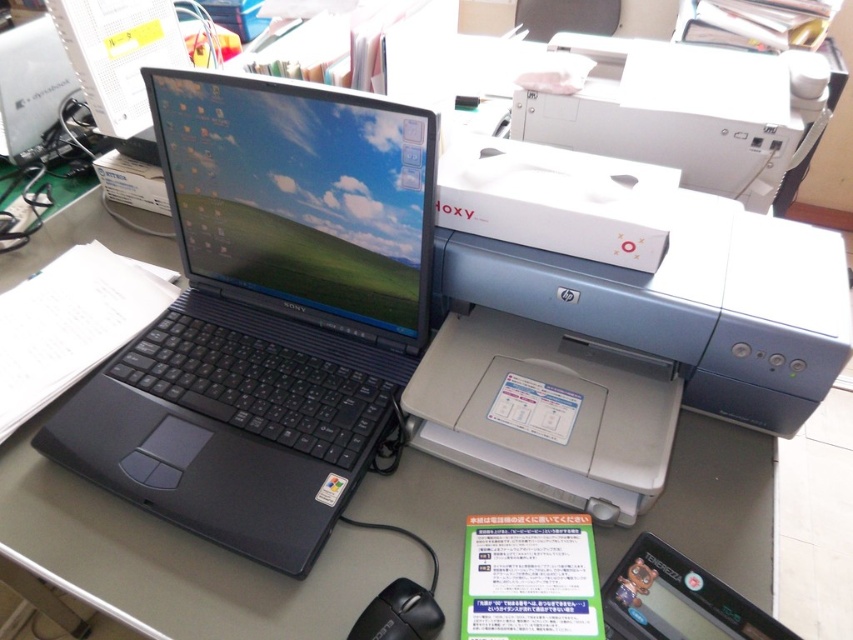
Locate an element on the screen. The image size is (853, 640). black matte laptop at center is located at coordinates [267, 314].

Is point (143, 440) closer to camera compared to point (749, 131)?

Yes, it is.

Describe the element at coordinates (267, 314) in the screenshot. The height and width of the screenshot is (640, 853). I see `black matte laptop at center` at that location.

Identify the location of black matte laptop at center. (267, 314).

Which is more to the right, matte black laptop at left or matte black laptop at upper left?

Positioned to the right is matte black laptop at left.

Between point (764, 467) and point (154, 147), which one is positioned behind?

The point (154, 147) is behind.

Find the location of `matte black laptop at left`. matte black laptop at left is located at coordinates (178, 561).

Where is `matte black laptop at left`? Image resolution: width=853 pixels, height=640 pixels. matte black laptop at left is located at coordinates (178, 561).

Which is in front, point (120, 104) or point (395, 593)?

Point (395, 593)

Based on the photo, who is higher up, matte black laptop at upper left or black plastic mouse at lower center?

matte black laptop at upper left is above.

Identify the location of matte black laptop at upper left. The height and width of the screenshot is (640, 853). (119, 60).

At what (x,y) coordinates should I click in order to perform the action: click on matte black laptop at upper left. Please return your answer as a coordinate pair (x, y). Looking at the image, I should click on (119, 60).